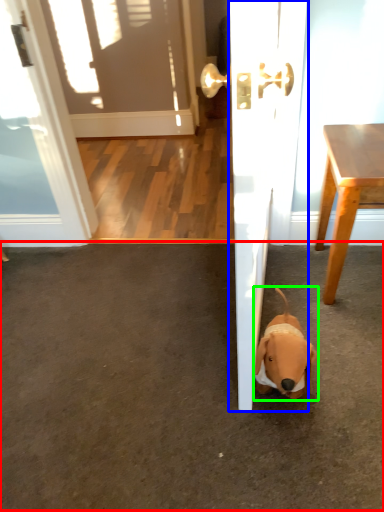
Question: Estimate the real-world distances between objects in this image. Which object is farther from concrete (highlighted by a red box), door (highlighted by a blue box) or dog (highlighted by a green box)?

Choices:
 (A) door
 (B) dog

Answer: (A)